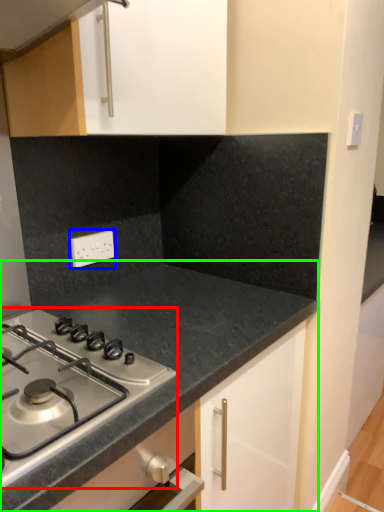
Question: Which object is positioned farthest from gas stove (highlighted by a red box)? Select from electric outlet (highlighted by a blue box) and countertop (highlighted by a green box).

Choices:
 (A) electric outlet
 (B) countertop

Answer: (A)